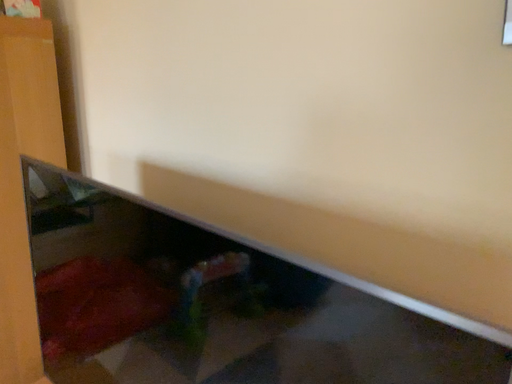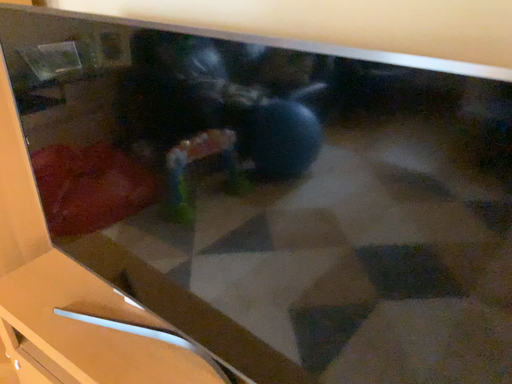
Question: Which way did the camera rotate in the video?

Choices:
 (A) rotated downward
 (B) rotated upward

Answer: (A)